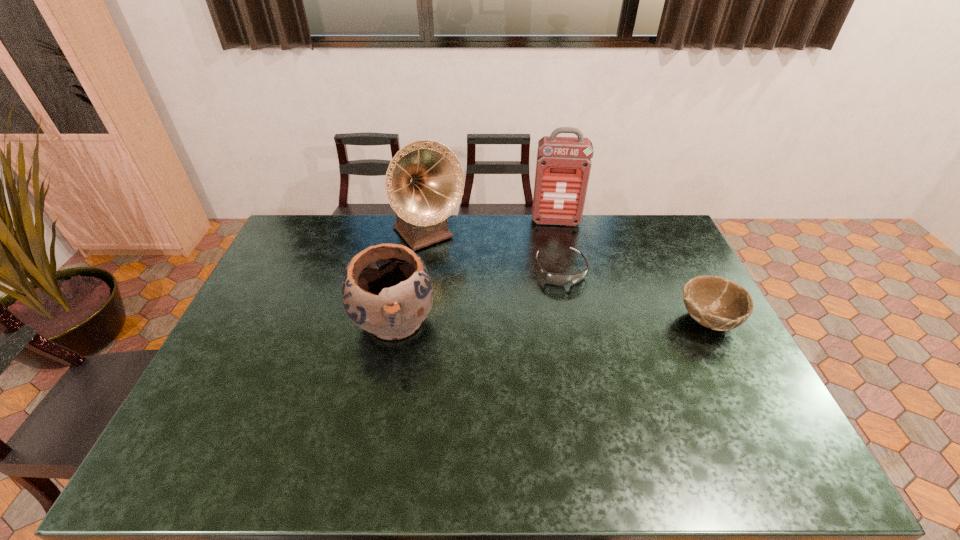
Locate an element on the screen. pottery is located at coordinates (386, 289).

At what (x,y) coordinates should I click in order to perform the action: click on bowl. Please return your answer as a coordinate pair (x, y). Looking at the image, I should click on (715, 302).

Identify the location of the fourth tallest object. (715, 302).

Find the location of `goggles`. goggles is located at coordinates click(557, 279).

Where is `the first-aid kit`? The height and width of the screenshot is (540, 960). the first-aid kit is located at coordinates (563, 165).

You are a GUI agent. You are given a task and a screenshot of the screen. Output one action in this format:
    pyautogui.click(x=<x>, y=<y>)
    Task: Click on the phonograph record
    The height and width of the screenshot is (540, 960).
    Given the screenshot: What is the action you would take?
    pyautogui.click(x=424, y=183)

The image size is (960, 540). I want to click on blank area located 0.180m on the front of the third shortest object, so click(375, 417).

The image size is (960, 540). Identify the location of vacant space situated 0.080m on the back of the fourth tallest object. (688, 282).

Locate an element on the screen. The width and height of the screenshot is (960, 540). free space located on the lenses of the goggles is located at coordinates (610, 372).

You are a GUI agent. You are given a task and a screenshot of the screen. Output one action in this format:
    pyautogui.click(x=<x>, y=<y>)
    Task: Click on the free spot located 0.230m on the lenses of the goggles
    The width and height of the screenshot is (960, 540).
    Given the screenshot: What is the action you would take?
    pyautogui.click(x=595, y=341)